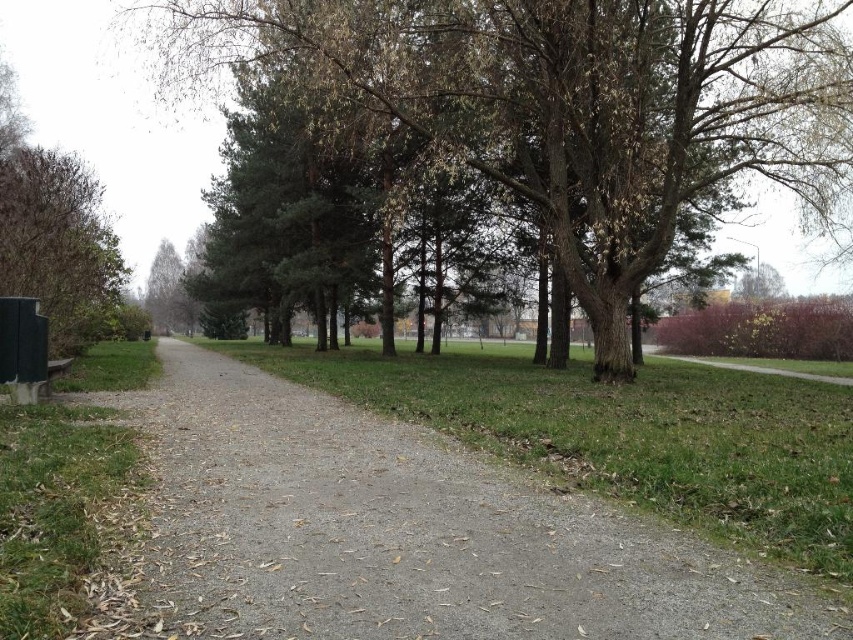
You are a park visitor carrying a picnic basket and want to find a spot under a tree for shade. You see the brown textured tree at center and the green matte tree at upper left. Which tree would provide more shade due to its size?

The brown textured tree at center is larger in size than the green matte tree at upper left, so it would provide more shade.

You are standing at the point marked by coordinates point (567, 104) in the image. Looking around, you see a brown textured tree at center. Which direction should you walk to reach the nearest tree?

The point (567, 104) marks the brown textured tree at center, so you are already at the tree. No need to walk further.

You are a gardener planning to plant a new tree in this park. You have two options for the location based on the existing trees. The green matte tree at left and the brown matte tree at upper right. Which location has a wider space available for planting a new tree?

The green matte tree at left has a larger width than the brown matte tree at upper right, so the location near the green matte tree at left offers more space for planting a new tree.